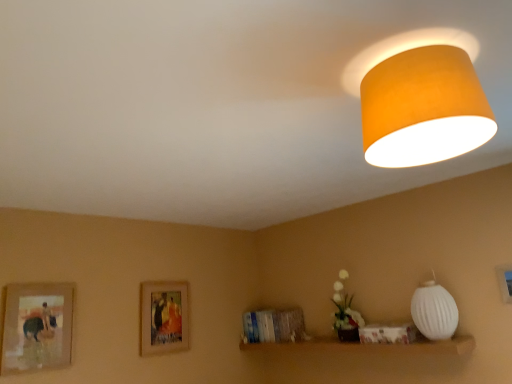
Question: Is wooden framed picture at left, the second picture frame when ordered from front to back, positioned far away from white ribbed lampshade at right, which is the 2th lamp from front to back?

Choices:
 (A) yes
 (B) no

Answer: (A)

Question: Is wooden framed picture at left, the second picture frame when ordered from front to back, taller than white ribbed lampshade at right, marked as the second lamp in a top-to-bottom arrangement?

Choices:
 (A) no
 (B) yes

Answer: (B)

Question: Can you confirm if wooden framed picture at left, the second picture frame when ordered from front to back, is positioned to the right of white ribbed lampshade at right, which is the first lamp from right to left?

Choices:
 (A) yes
 (B) no

Answer: (B)

Question: Does wooden framed picture at left, the second picture frame when ordered from front to back, have a greater width compared to white ribbed lampshade at right, placed as the first lamp when sorted from bottom to top?

Choices:
 (A) no
 (B) yes

Answer: (A)

Question: From the image's perspective, does wooden framed picture at left, the 1th picture frame positioned from the left, appear higher than white ribbed lampshade at right, marked as the second lamp in a top-to-bottom arrangement?

Choices:
 (A) yes
 (B) no

Answer: (B)

Question: Is wooden framed picture at left, the second picture frame when ordered from front to back, to the left or to the right of orange fabric lampshade at upper right, acting as the 2th lamp starting from the right, in the image?

Choices:
 (A) right
 (B) left

Answer: (B)

Question: Based on their sizes in the image, would you say wooden framed picture at left, positioned as the 3th picture frame in right-to-left order, is bigger or smaller than orange fabric lampshade at upper right, which is counted as the 1th lamp, starting from the front?

Choices:
 (A) big
 (B) small

Answer: (B)

Question: Is point [14, 370] positioned closer to the camera than point [397, 119]?

Choices:
 (A) farther
 (B) closer

Answer: (A)

Question: From the image's perspective, is wooden framed picture at left, positioned as the 3th picture frame in right-to-left order, located above or below orange fabric lampshade at upper right, which is the second lamp in bottom-to-top order?

Choices:
 (A) below
 (B) above

Answer: (A)

Question: Considering their positions, is white ribbed lampshade at right, the 2th lamp positioned from the left, located in front of or behind wooden framed picture at center, placed as the 3th picture frame when sorted from front to back?

Choices:
 (A) behind
 (B) front

Answer: (B)

Question: Considering the positions of point (415, 324) and point (157, 301), is point (415, 324) closer or farther from the camera than point (157, 301)?

Choices:
 (A) farther
 (B) closer

Answer: (B)

Question: Based on their positions, is white ribbed lampshade at right, which is the 2th lamp from front to back, located to the left or right of wooden framed picture at center, placed as the 3th picture frame when sorted from front to back?

Choices:
 (A) right
 (B) left

Answer: (A)

Question: Considering the positions of white ribbed lampshade at right, the 2th lamp positioned from the left, and wooden framed picture at center, arranged as the 2th picture frame when viewed from the right, in the image, is white ribbed lampshade at right, the 2th lamp positioned from the left, taller or shorter than wooden framed picture at center, arranged as the 2th picture frame when viewed from the right,?

Choices:
 (A) tall
 (B) short

Answer: (B)

Question: Considering the positions of wooden framed picture at center, arranged as the 2th picture frame when viewed from the right, and orange fabric lampshade at upper right, which is counted as the 1th lamp, starting from the front, in the image, is wooden framed picture at center, arranged as the 2th picture frame when viewed from the right, wider or thinner than orange fabric lampshade at upper right, which is counted as the 1th lamp, starting from the front,?

Choices:
 (A) thin
 (B) wide

Answer: (A)

Question: Considering the positions of point (156, 286) and point (403, 69), is point (156, 286) closer or farther from the camera than point (403, 69)?

Choices:
 (A) farther
 (B) closer

Answer: (A)